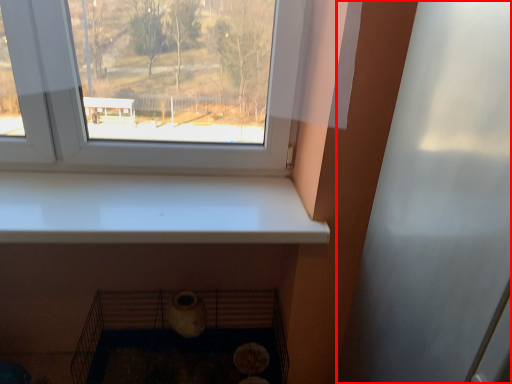
Question: From the image, what is the correct spatial relationship of screen door (annotated by the red box) in relation to shelf?

Choices:
 (A) left
 (B) right

Answer: (B)